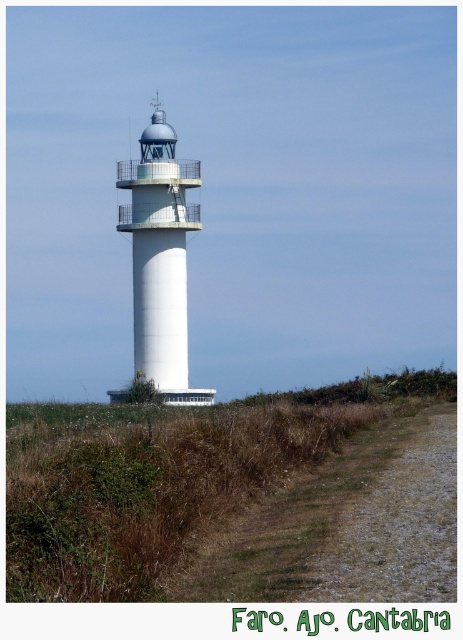
In the scene shown: You are standing at the lighthouse and looking towards the dirt path. There are two points marked on the path. Which point is closer to you, point [268,404] or point [166,273]?

Point [268,404] is in front of point [166,273], so it is closer to you.

You are standing at the edge of the dirt path and want to walk towards the lighthouse. As you approach, you notice the green grass at center and the white smooth lighthouse at center. Which one appears wider from your perspective?

The green grass at center appears wider than the white smooth lighthouse at center because the grass has a larger width according to the description.